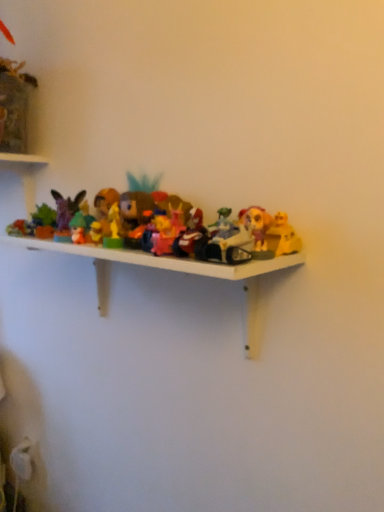
This screenshot has width=384, height=512. What do you see at coordinates (256, 224) in the screenshot?
I see `yellow plastic toy at right, which is counted as the first toy, starting from the right` at bounding box center [256, 224].

Find the location of a particular element. The image size is (384, 512). matte purple figurine at left, the 1th toy positioned from the left is located at coordinates (66, 213).

Measure the distance between matte purple figurine at left, which ranks as the seventh toy in right-to-left order, and camera.

The distance of matte purple figurine at left, which ranks as the seventh toy in right-to-left order, from camera is 74.30 centimeters.

Identify the location of yellow plastic toy at right, which is counted as the first toy, starting from the right. The image size is (384, 512). (256, 224).

Considering the points (242, 216) and (73, 216), which point is in front, point (242, 216) or point (73, 216)?

The point (242, 216) is more forward.

Locate an element on the screen. This screenshot has height=512, width=384. the 4th toy in front of the matte purple figurine at left, the 1th toy positioned from the left, counting from the anchor's position is located at coordinates (256, 224).

In the scene shown: Between yellow plastic toy at right, the seventh toy when ordered from left to right, and matte purple figurine at left, the 1th toy positioned from the left, which one has larger width?

yellow plastic toy at right, the seventh toy when ordered from left to right, is wider.

Would you say yellow plastic toy at right, which is counted as the first toy, starting from the right, is outside matte purple figurine at left, the 1th toy positioned from the left?

Absolutely, yellow plastic toy at right, which is counted as the first toy, starting from the right, is external to matte purple figurine at left, the 1th toy positioned from the left.

From the image's perspective, who appears lower, green matte figurine at center, which ranks as the second toy in left-to-right order, or yellow plastic toy at right, the seventh toy when ordered from left to right?

yellow plastic toy at right, the seventh toy when ordered from left to right, appears lower in the image.

Which of these two, green matte figurine at center, positioned as the sixth toy in right-to-left order, or yellow plastic toy at right, which is counted as the first toy, starting from the right, is smaller?

Smaller between the two is green matte figurine at center, positioned as the sixth toy in right-to-left order.

Is the surface of green matte figurine at center, positioned as the sixth toy in right-to-left order, in direct contact with yellow plastic toy at right, which is counted as the first toy, starting from the right?

No, green matte figurine at center, positioned as the sixth toy in right-to-left order, is not touching yellow plastic toy at right, which is counted as the first toy, starting from the right.

Based on the photo, does green matte figurine at center, positioned as the sixth toy in right-to-left order, turn towards yellow plastic toy at right, the seventh toy when ordered from left to right?

No.

Which of these two, green matte figurine at center, which ranks as the second toy in left-to-right order, or matte purple figurine at left, the 1th toy positioned from the left, stands taller?

matte purple figurine at left, the 1th toy positioned from the left, is taller.

From a real-world perspective, is green matte figurine at center, which ranks as the second toy in left-to-right order, physically above matte purple figurine at left, the 1th toy positioned from the left?

No.

Considering the points (80, 226) and (74, 206), which point is behind, point (80, 226) or point (74, 206)?

Positioned behind is point (74, 206).

Considering the relative sizes of green matte figurine at center, which ranks as the second toy in left-to-right order, and matte purple figurine at left, which ranks as the seventh toy in right-to-left order, in the image provided, is green matte figurine at center, which ranks as the second toy in left-to-right order, wider than matte purple figurine at left, which ranks as the seventh toy in right-to-left order,?

In fact, green matte figurine at center, which ranks as the second toy in left-to-right order, might be narrower than matte purple figurine at left, which ranks as the seventh toy in right-to-left order.

How many degrees apart are the facing directions of green matte figurine at center, which ranks as the second toy in left-to-right order, and matte plastic toy at center, which is the third toy from left to right?

green matte figurine at center, which ranks as the second toy in left-to-right order, and matte plastic toy at center, which is the third toy from left to right, are facing 0.0135 degrees away from each other.

From the image's perspective, does green matte figurine at center, positioned as the sixth toy in right-to-left order, appear lower than matte plastic toy at center, which is the third toy from left to right?

Actually, green matte figurine at center, positioned as the sixth toy in right-to-left order, appears above matte plastic toy at center, which is the third toy from left to right, in the image.

Which object is closer to the camera, green matte figurine at center, which ranks as the second toy in left-to-right order, or matte plastic toy at center, which is the third toy from left to right?

matte plastic toy at center, which is the third toy from left to right, is in front.

From a real-world perspective, who is located lower, green matte figurine at center, positioned as the sixth toy in right-to-left order, or matte plastic toy at center, the 5th toy viewed from the right?

From a 3D spatial view, green matte figurine at center, positioned as the sixth toy in right-to-left order, is below.

Is there a large distance between matte plastic toy at center, acting as the fifth toy starting from the left, and matte plastic toy at center, the 5th toy viewed from the right?

No, matte plastic toy at center, acting as the fifth toy starting from the left, is not far from matte plastic toy at center, the 5th toy viewed from the right.

Is matte plastic toy at center, the third toy positioned from the right, outside of matte plastic toy at center, which is the third toy from left to right?

That's correct, matte plastic toy at center, the third toy positioned from the right, is outside of matte plastic toy at center, which is the third toy from left to right.

Visually, is matte plastic toy at center, the third toy positioned from the right, positioned to the left or to the right of matte plastic toy at center, the 5th toy viewed from the right?

In the image, matte plastic toy at center, the third toy positioned from the right, appears on the right side of matte plastic toy at center, the 5th toy viewed from the right.

From the image's perspective, which toy is the 3rd one below the pink plastic toy at center, the fourth toy from the left? Please provide its 2D coordinates.

[(225, 241)]

From the picture: Who is shorter, shiny silver motorcycle at center, which is counted as the 6th toy, starting from the left, or pink plastic toy at center, the fourth toy from the left?

shiny silver motorcycle at center, which is counted as the 6th toy, starting from the left.

Is point (223, 238) closer or farther from the camera than point (175, 228)?

Point (223, 238) appears to be closer to the viewer than point (175, 228).

From a real-world perspective, does shiny silver motorcycle at center, which is counted as the 6th toy, starting from the left, stand above pink plastic toy at center, which appears as the fourth toy when viewed from the right?

Yes.

From a real-world perspective, is matte purple figurine at left, which ranks as the seventh toy in right-to-left order, above or below shiny silver motorcycle at center, which is counted as the 6th toy, starting from the left?

In terms of real-world spatial position, matte purple figurine at left, which ranks as the seventh toy in right-to-left order, is above shiny silver motorcycle at center, which is counted as the 6th toy, starting from the left.

Is matte purple figurine at left, the 1th toy positioned from the left, positioned far away from shiny silver motorcycle at center, the second toy in the right-to-left sequence?

matte purple figurine at left, the 1th toy positioned from the left, is actually quite close to shiny silver motorcycle at center, the second toy in the right-to-left sequence.

Can you confirm if matte purple figurine at left, the 1th toy positioned from the left, is bigger than shiny silver motorcycle at center, the second toy in the right-to-left sequence?

No.

From the image's perspective, starting from the yellow plastic toy at right, the seventh toy when ordered from left to right, which toy is the 4th one above? Please provide its 2D coordinates.

[(66, 213)]

From a real-world perspective, which toy is the 5th one underneath the yellow plastic toy at right, the seventh toy when ordered from left to right? Please provide its 2D coordinates.

[(78, 228)]

Considering their positions, is pink plastic toy at center, which appears as the fourth toy when viewed from the right, positioned closer to matte plastic toy at center, the 5th toy viewed from the right, than matte plastic toy at center, the third toy positioned from the right?

Based on the image, pink plastic toy at center, which appears as the fourth toy when viewed from the right, appears to be nearer to matte plastic toy at center, the 5th toy viewed from the right.

Considering their positions, is green matte figurine at center, which ranks as the second toy in left-to-right order, positioned closer to yellow plastic toy at right, which is counted as the first toy, starting from the right, than pink plastic toy at center, which appears as the fourth toy when viewed from the right?

pink plastic toy at center, which appears as the fourth toy when viewed from the right.

Based on the photo, based on their spatial positions, is matte plastic toy at center, the 5th toy viewed from the right, or matte purple figurine at left, the 1th toy positioned from the left, further from green matte figurine at center, which ranks as the second toy in left-to-right order?

The object further to green matte figurine at center, which ranks as the second toy in left-to-right order, is matte plastic toy at center, the 5th toy viewed from the right.

Considering their positions, is pink plastic toy at center, which appears as the fourth toy when viewed from the right, positioned closer to matte plastic toy at center, the third toy positioned from the right, than yellow plastic toy at right, which is counted as the first toy, starting from the right?

pink plastic toy at center, which appears as the fourth toy when viewed from the right, is positioned closer to the anchor matte plastic toy at center, the third toy positioned from the right.

From the image, which object appears to be farther from green matte figurine at center, which ranks as the second toy in left-to-right order, shiny silver motorcycle at center, which is counted as the 6th toy, starting from the left, or matte plastic toy at center, which is the third toy from left to right?

The object further to green matte figurine at center, which ranks as the second toy in left-to-right order, is shiny silver motorcycle at center, which is counted as the 6th toy, starting from the left.

Considering their positions, is shiny silver motorcycle at center, which is counted as the 6th toy, starting from the left, positioned further to green matte figurine at center, which ranks as the second toy in left-to-right order, than pink plastic toy at center, the fourth toy from the left?

shiny silver motorcycle at center, which is counted as the 6th toy, starting from the left.

Looking at the image, which one is located further to yellow plastic toy at right, which is counted as the first toy, starting from the right, matte plastic toy at center, the third toy positioned from the right, or matte purple figurine at left, which ranks as the seventh toy in right-to-left order?

Among the two, matte purple figurine at left, which ranks as the seventh toy in right-to-left order, is located further to yellow plastic toy at right, which is counted as the first toy, starting from the right.

Based on their spatial positions, is shiny silver motorcycle at center, which is counted as the 6th toy, starting from the left, or matte plastic toy at center, the 5th toy viewed from the right, closer to pink plastic toy at center, which appears as the fourth toy when viewed from the right?

matte plastic toy at center, the 5th toy viewed from the right, is closer to pink plastic toy at center, which appears as the fourth toy when viewed from the right.

Where is `toy situated between green matte figurine at center, positioned as the sixth toy in right-to-left order, and pink plastic toy at center, the fourth toy from the left, from left to right`? The image size is (384, 512). toy situated between green matte figurine at center, positioned as the sixth toy in right-to-left order, and pink plastic toy at center, the fourth toy from the left, from left to right is located at coordinates (135, 216).

You are a GUI agent. You are given a task and a screenshot of the screen. Output one action in this format:
    pyautogui.click(x=<x>, y=<y>)
    Task: Click on the toy between matte plastic toy at center, the third toy positioned from the right, and yellow plastic toy at right, which is counted as the first toy, starting from the right, from left to right
    The height and width of the screenshot is (512, 384).
    Given the screenshot: What is the action you would take?
    point(225,241)

Find the location of a particular element. toy between matte purple figurine at left, which ranks as the seventh toy in right-to-left order, and matte plastic toy at center, the 5th toy viewed from the right, in the horizontal direction is located at coordinates (78, 228).

Locate an element on the screen. Image resolution: width=384 pixels, height=512 pixels. toy located between pink plastic toy at center, the fourth toy from the left, and shiny silver motorcycle at center, the second toy in the right-to-left sequence, in the left-right direction is located at coordinates (192, 236).